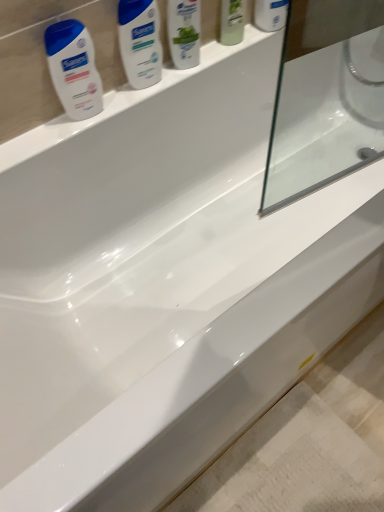
Locate an element on the screen. free space to the right of white glossy lotion at upper left is located at coordinates (191, 69).